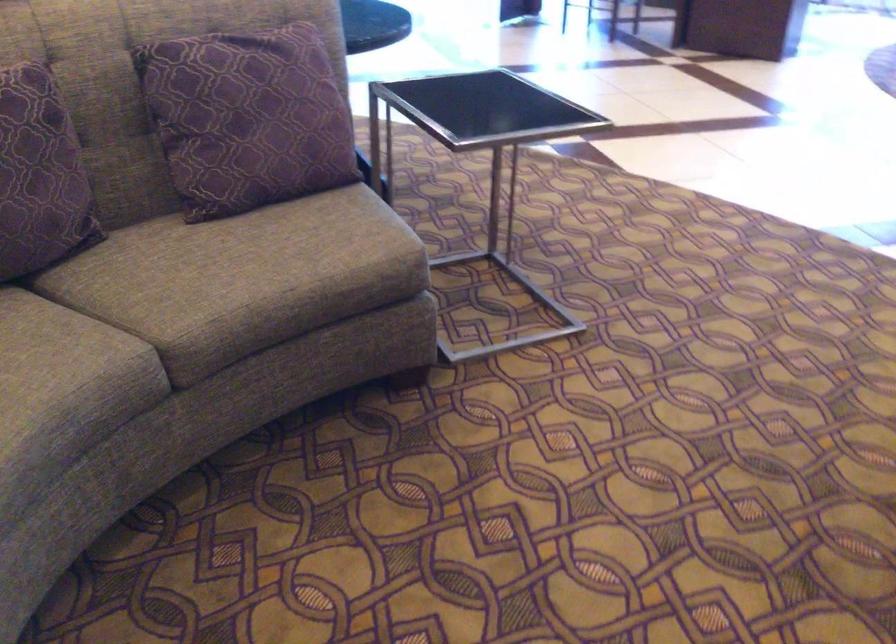
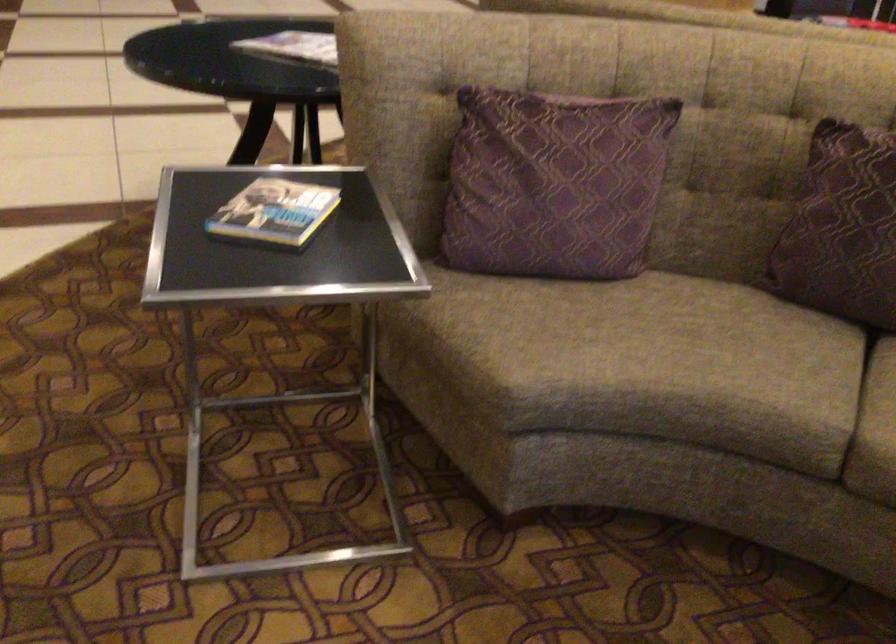
Based on the continuous images, in which direction is the camera rotating?

The camera's rotation is toward left-down.